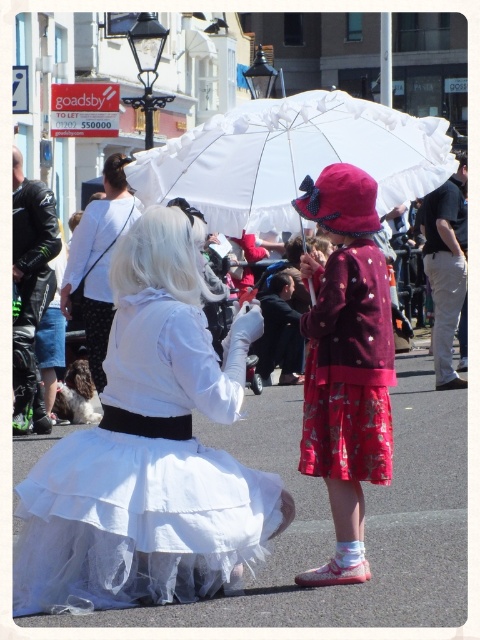
Based on the photo, you are a photographer trying to capture the interaction between the two individuals in the scene. You want to frame the shot so that the white tulle skirt at center and the white lace umbrella at upper center are both visible. Based on their positions, which object should you position closer to the left side of your camera frame?

The white tulle skirt at center should be positioned closer to the left side of your camera frame because it is located to the left of the white lace umbrella at upper center.

You are a photographer trying to capture the matte burgundy coat at center in your shot. Based on the scene description, where should you position your camera to ensure the coat is centered in the frame?

To center the matte burgundy coat at center in your frame, position your camera so that the coat is located at the coordinates point [346,362].